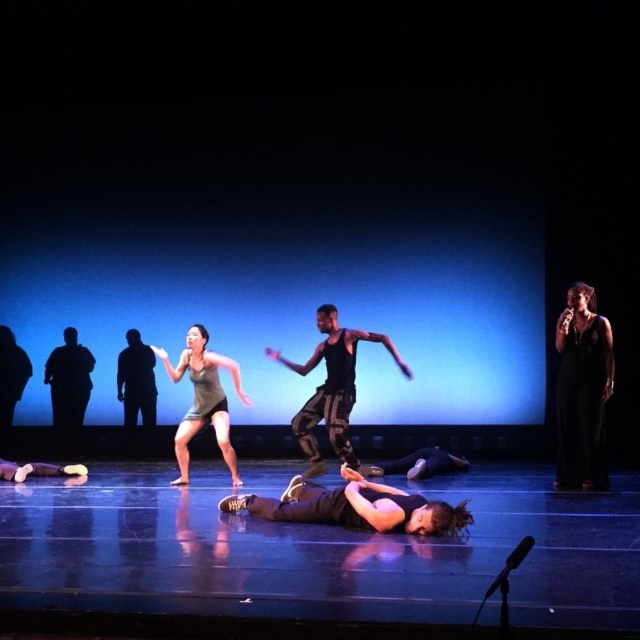
What is the object located at the coordinate point (332, 388) in the image?

The object located at the coordinate point (332, 388) is the black mesh tank top at center.

You are a stagehand observing the dance performance. You need to place a spotlight on the matte gray tank top at center. From your position, which side of the black matte figure at left should you aim the spotlight towards?

The matte gray tank top at center is to the right of the black matte figure at left, so you should aim the spotlight to the right side of the black matte figure at left.

You are a stagehand responsible for adjusting the lighting during a performance. The director wants to ensure that the spotlight can reach both the matte gray tank top at center and the black matte figure at left simultaneously. Given that the spotlight has a maximum range of 10 feet, can you confirm if both performers will be illuminated adequately?

The matte gray tank top at center is 10.67 feet from the black matte figure at left. Since the distance between them exceeds the spotlight maximum range of 10 feet, the spotlight cannot illuminate both performers simultaneously.